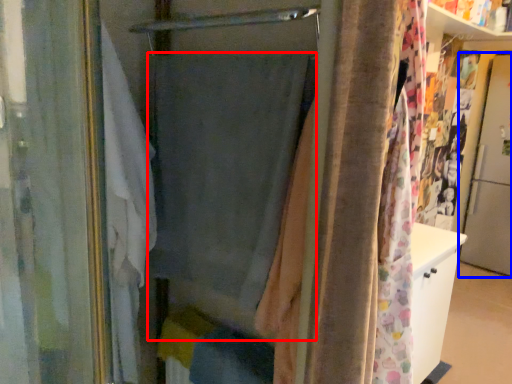
Question: Which object appears closest to the camera in this image, curtain (highlighted by a red box) or screen door (highlighted by a blue box)?

Choices:
 (A) curtain
 (B) screen door

Answer: (A)